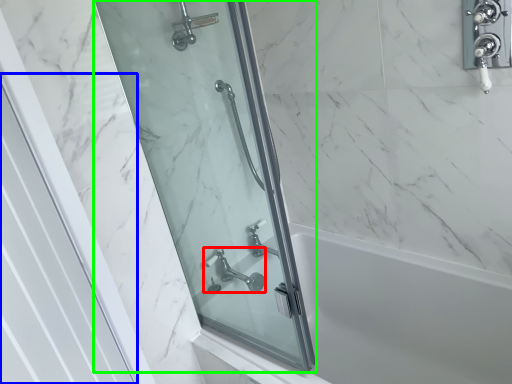
Question: Which is nearer to the tap (highlighted by a red box)? screen door (highlighted by a blue box) or screen door (highlighted by a green box).

Choices:
 (A) screen door
 (B) screen door

Answer: (B)